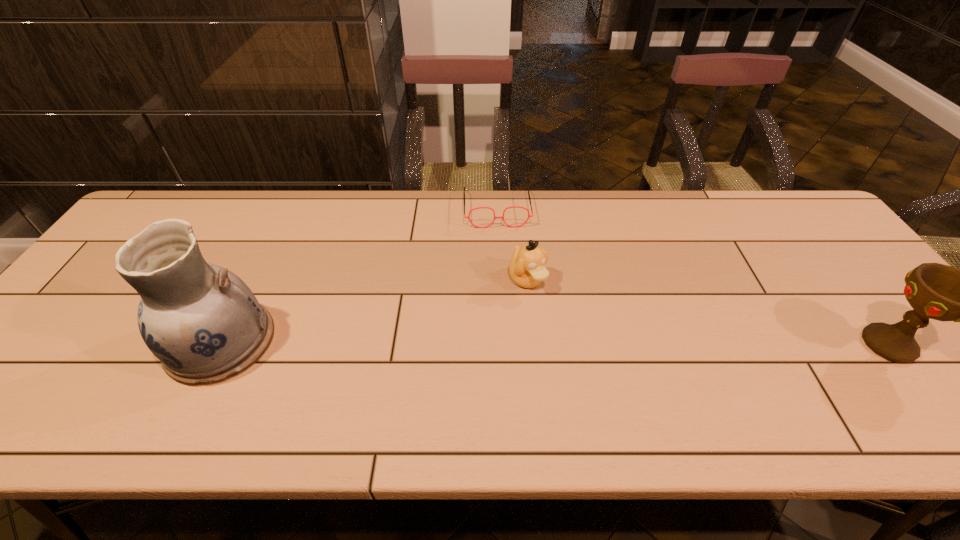
You are a GUI agent. You are given a task and a screenshot of the screen. Output one action in this format:
    pyautogui.click(x=<x>, y=<y>)
    Task: Click on the pottery
    The height and width of the screenshot is (540, 960).
    Given the screenshot: What is the action you would take?
    pyautogui.click(x=205, y=325)

The height and width of the screenshot is (540, 960). What are the coordinates of `the leftmost object` in the screenshot? It's located at (205, 325).

Image resolution: width=960 pixels, height=540 pixels. Identify the location of the rightmost object. (936, 291).

This screenshot has height=540, width=960. In order to click on the third shortest object in this screenshot , I will do `click(936, 291)`.

Where is `the second farthest object`? the second farthest object is located at coordinates (527, 269).

Where is `duckling`? This screenshot has height=540, width=960. duckling is located at coordinates (527, 269).

Locate an element on the screen. the farthest object is located at coordinates (468, 217).

At what (x,y) coordinates should I click in order to perform the action: click on spectacles. Please return your answer as a coordinate pair (x, y). The width and height of the screenshot is (960, 540). Looking at the image, I should click on (468, 217).

The width and height of the screenshot is (960, 540). I want to click on vacant space located on the back of the tallest object, so click(x=263, y=257).

Identify the location of free space located on the back of the rightmost object. This screenshot has height=540, width=960. (815, 250).